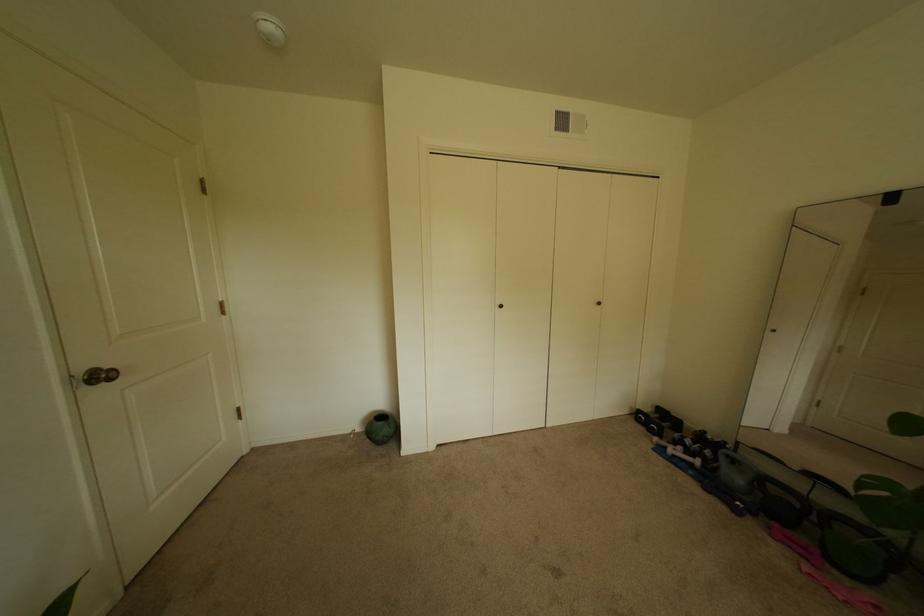
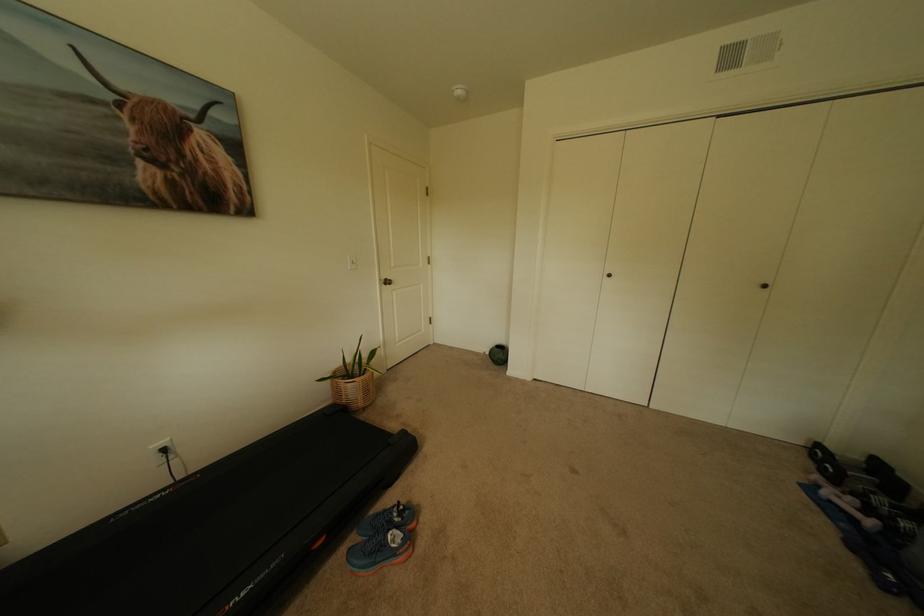
Question: Based on the continuous images, in which direction is the camera rotating? Reply with the corresponding letter.

Choices:
 (A) Left
 (B) Right
 (C) Up
 (D) Down

Answer: (A)